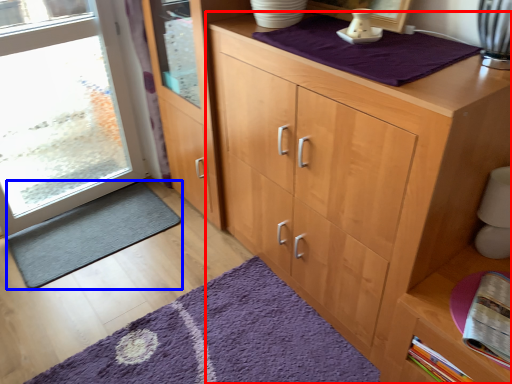
Question: Which object is closer to the camera taking this photo, cupboard (highlighted by a red box) or doormat (highlighted by a blue box)?

Choices:
 (A) cupboard
 (B) doormat

Answer: (A)